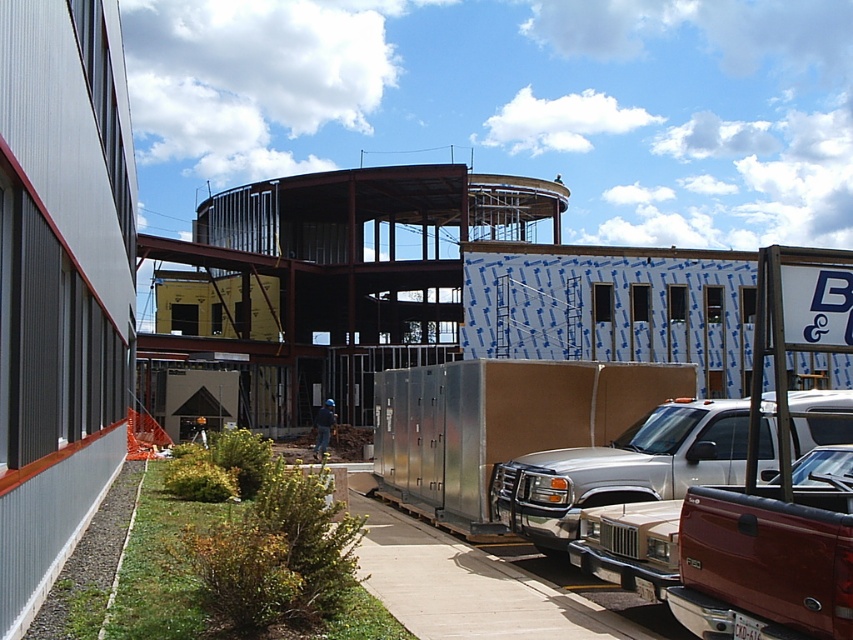
Question: Which point is closer to the camera taking this photo?

Choices:
 (A) (671, 376)
 (B) (564, 548)

Answer: (B)

Question: Which object is farther from the camera taking this photo?

Choices:
 (A) silver metallic trailer at center
 (B) silver metallic truck at center

Answer: (A)

Question: Which point is farther to the camera?

Choices:
 (A) silver metallic truck at center
 (B) silver metallic trailer at center
 (C) metallic silver truck at lower right

Answer: (B)

Question: Is silver metallic trailer at center below metallic silver truck at lower right?

Choices:
 (A) yes
 (B) no

Answer: (B)

Question: Can you confirm if silver metallic trailer at center is wider than metallic silver truck at lower right?

Choices:
 (A) no
 (B) yes

Answer: (A)

Question: Does silver metallic trailer at center appear under metallic silver truck at lower right?

Choices:
 (A) yes
 (B) no

Answer: (B)